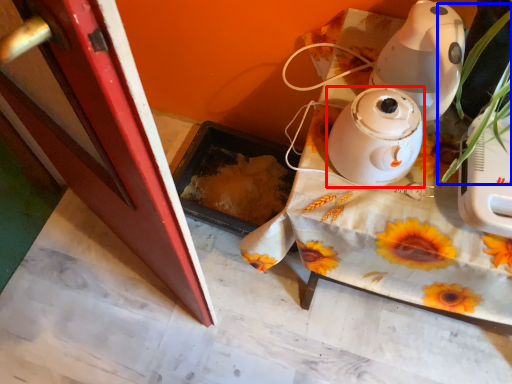
Question: Which object appears closest to the camera in this image, home appliance (highlighted by a red box) or plant (highlighted by a blue box)?

Choices:
 (A) home appliance
 (B) plant

Answer: (B)